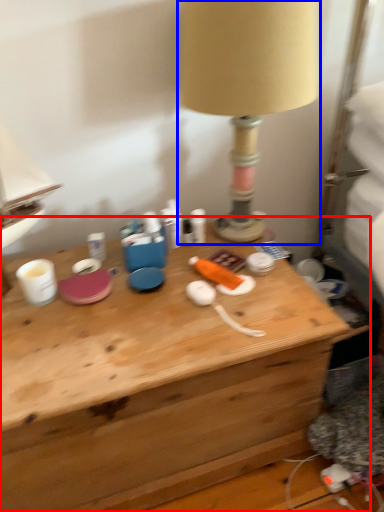
Question: Which of the following is the closest to the observer, desk (highlighted by a red box) or lamp (highlighted by a blue box)?

Choices:
 (A) desk
 (B) lamp

Answer: (A)